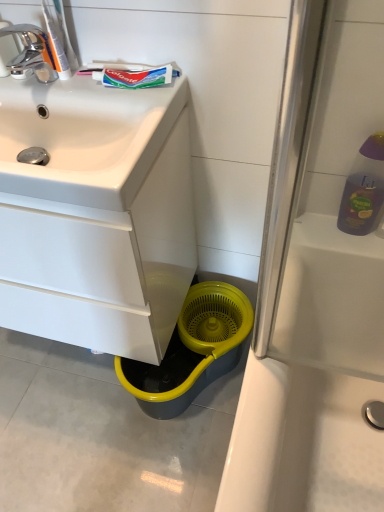
Question: Would you say chrome/metallic faucet at upper left is inside or outside colgate toothpaste at upper left, arranged as the second toothpaste when viewed from the left?

Choices:
 (A) outside
 (B) inside

Answer: (A)

Question: Is chrome/metallic faucet at upper left to the left or to the right of colgate toothpaste at upper left, arranged as the second toothpaste when viewed from the left, in the image?

Choices:
 (A) right
 (B) left

Answer: (B)

Question: Which is nearer to the white glossy cabinet at lower left?

Choices:
 (A) white matte toothpaste at upper left, the first toothpaste in the left-to-right sequence
 (B) white glossy sink at upper left
 (C) chrome/metallic faucet at upper left
 (D) colgate toothpaste at upper left, arranged as the second toothpaste when viewed from the left

Answer: (B)

Question: Which object is the closest to the colgate toothpaste at upper left, which is counted as the 1th toothpaste, starting from the right?

Choices:
 (A) white glossy cabinet at lower left
 (B) chrome/metallic faucet at upper left
 (C) white matte toothpaste at upper left, the first toothpaste in the left-to-right sequence
 (D) white glossy sink at upper left

Answer: (C)